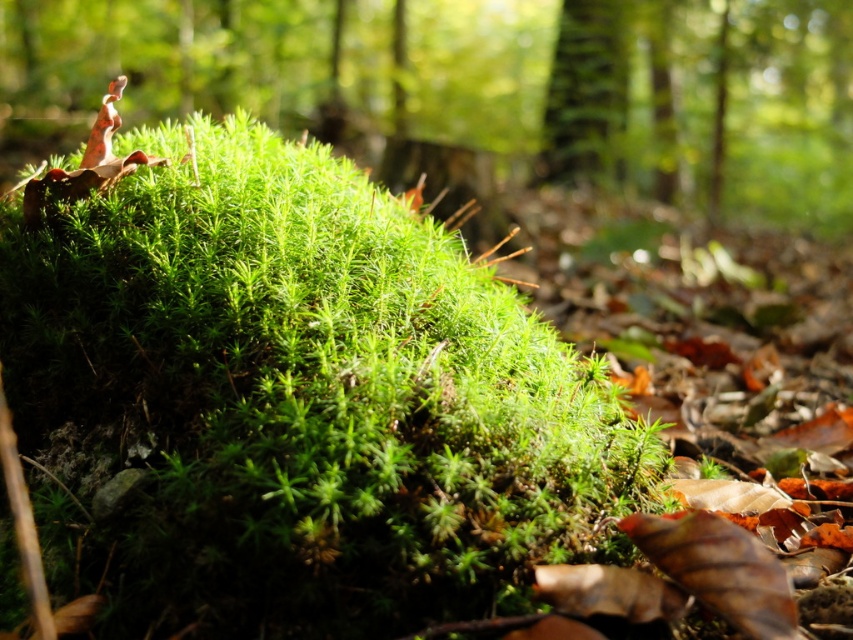
Is the position of green fuzzy moss at center more distant than that of green textured bark at upper center?

No.

Is green fuzzy moss at center taller than green textured bark at upper center?

Yes.

Which is behind, point (682, 96) or point (561, 70)?

Positioned behind is point (682, 96).

Where is `green fuzzy moss at center`? green fuzzy moss at center is located at coordinates (165, 56).